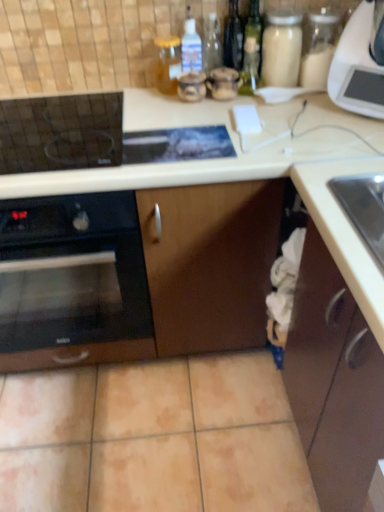
Locate an element on the screen. The image size is (384, 512). blank space to the left of translucent glass jar at upper center is located at coordinates [119, 96].